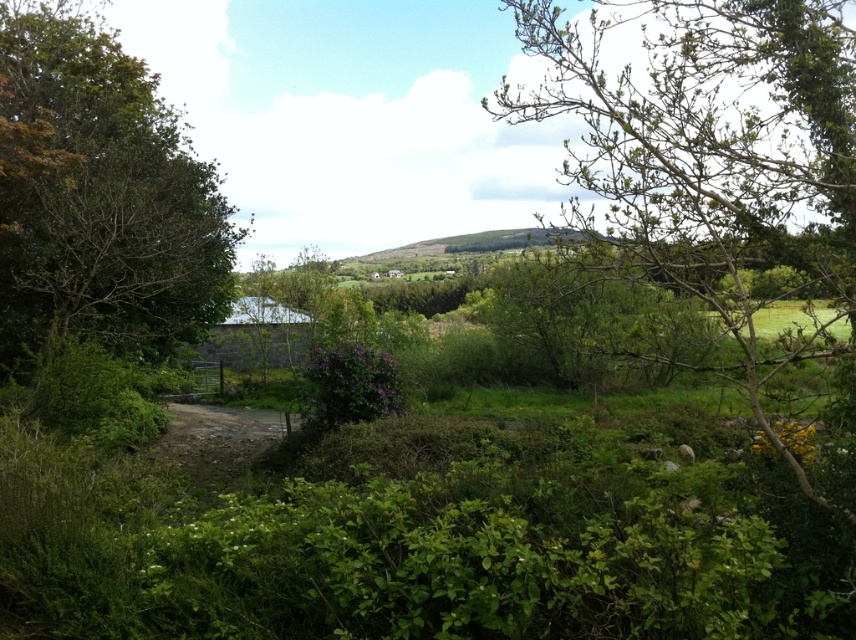
Is bare branches at upper right positioned before green leafy tree at left?

Yes.

Is bare branches at upper right below green leafy tree at left?

Yes, bare branches at upper right is below green leafy tree at left.

Is point (779, 234) farther from camera compared to point (10, 212)?

No, (779, 234) is in front of (10, 212).

The image size is (856, 640). What are the coordinates of `bare branches at upper right` in the screenshot? It's located at (712, 150).

Does bare branches at upper right appear on the left side of dirt/gravel path at center?

In fact, bare branches at upper right is to the right of dirt/gravel path at center.

Locate an element on the screen. This screenshot has height=640, width=856. bare branches at upper right is located at coordinates (712, 150).

Image resolution: width=856 pixels, height=640 pixels. Identify the location of bare branches at upper right. (712, 150).

Does point (164, 166) lie behind point (247, 417)?

No.

Between point (39, 84) and point (290, 417), which one is positioned behind?

The point (290, 417) is more distant.

Is point (27, 314) closer to viewer compared to point (259, 417)?

Yes.

The height and width of the screenshot is (640, 856). In order to click on green leafy tree at left in this screenshot , I will do `click(99, 196)`.